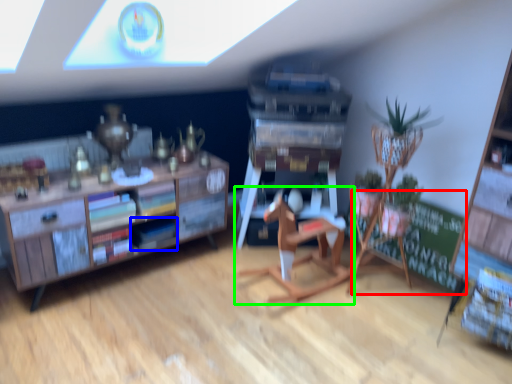
Question: Considering the real-world distances, which object is farthest from bulletin board (highlighted by a red box)? book (highlighted by a blue box) or chair (highlighted by a green box)?

Choices:
 (A) book
 (B) chair

Answer: (A)